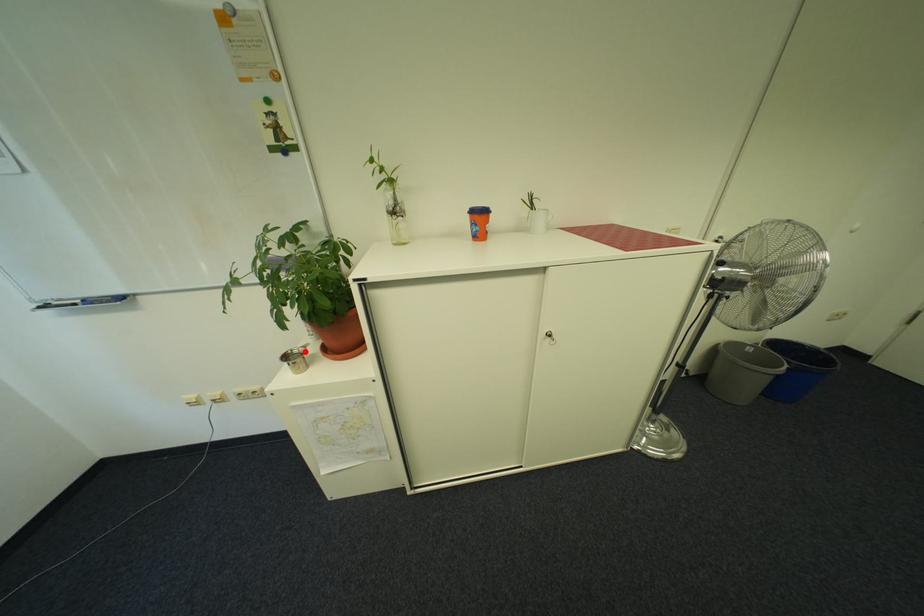
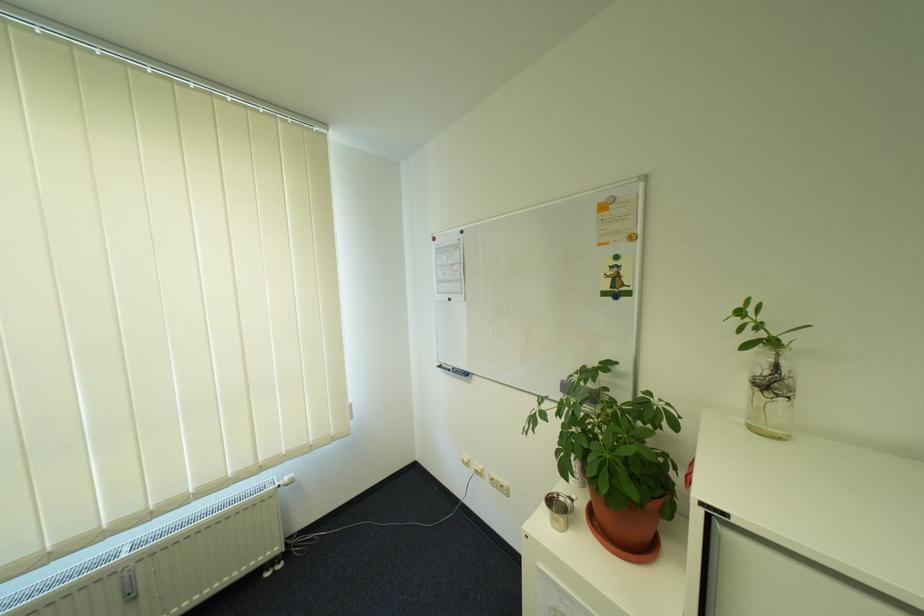
Where in the second image is the point corresponding to the highlighted location from the first image?

(572, 500)